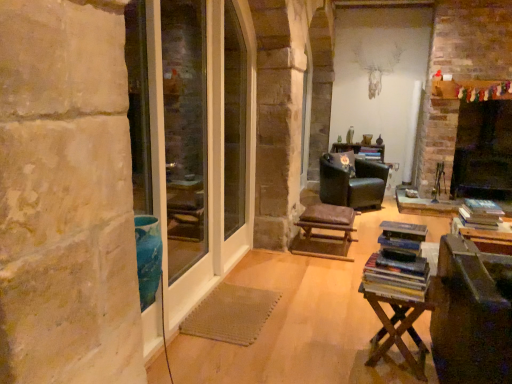
At what (x,y) coordinates should I click in order to perform the action: click on vacant space to the right of clear glass door at left, the first screen door viewed from the left. Please return your answer as a coordinate pair (x, y). The height and width of the screenshot is (384, 512). Looking at the image, I should click on (253, 312).